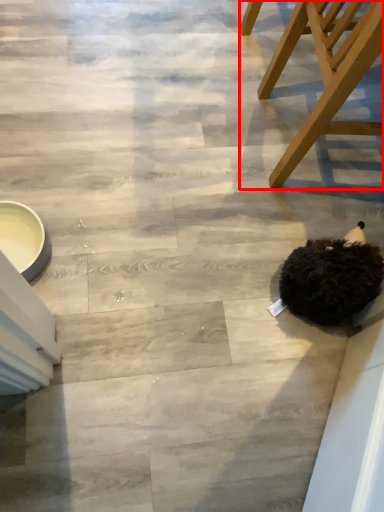
Question: From the image's perspective, what is the correct spatial positioning of chair (annotated by the red box) in reference to animal?

Choices:
 (A) above
 (B) below

Answer: (A)